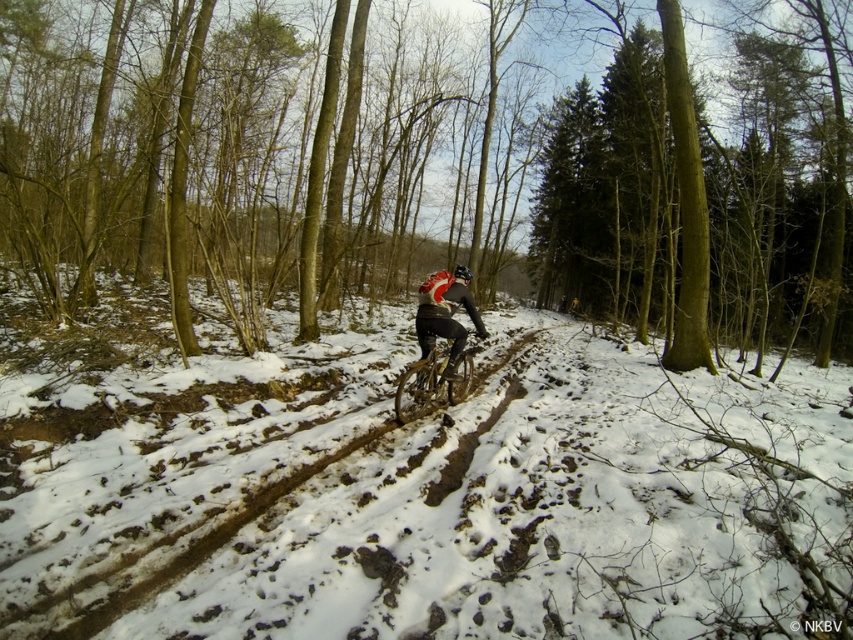
Question: Observing the image, what is the correct spatial positioning of matte black cycling suit at center in reference to shiny black bike at center?

Choices:
 (A) above
 (B) below

Answer: (A)

Question: Which object is positioned closest to the matte black cycling suit at center?

Choices:
 (A) white powdery snow at center
 (B) shiny black bike at center
 (C) brown wood tree at center

Answer: (B)

Question: Which point is closer to the camera taking this photo?

Choices:
 (A) (724, 381)
 (B) (422, 301)
 (C) (419, 413)
 (D) (152, 125)

Answer: (C)

Question: From the image, what is the correct spatial relationship of white powdery snow at center in relation to shiny black bike at center?

Choices:
 (A) left
 (B) right

Answer: (A)

Question: Which object is the closest to the matte black cycling suit at center?

Choices:
 (A) white powdery snow at center
 (B) shiny black bike at center

Answer: (B)

Question: Is white powdery snow at center further to camera compared to shiny black bike at center?

Choices:
 (A) no
 (B) yes

Answer: (A)